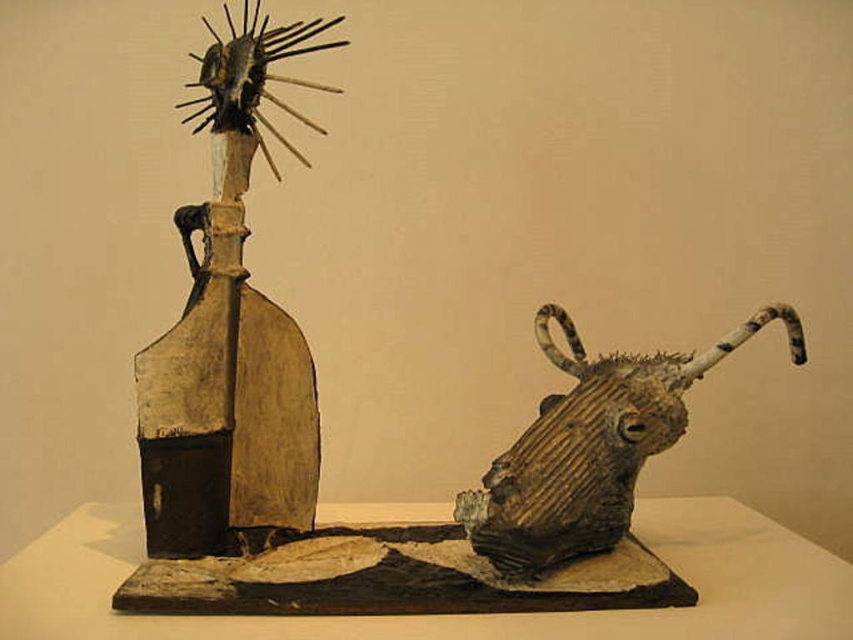
Question: Is wooden bottle at left bigger than rustic wood bull head at right?

Choices:
 (A) yes
 (B) no

Answer: (B)

Question: Which object appears farthest from the camera in this image?

Choices:
 (A) wooden bottle at left
 (B) rustic wood bull head at right

Answer: (A)

Question: Is wooden bottle at left further to the viewer compared to rustic wood bull head at right?

Choices:
 (A) yes
 (B) no

Answer: (A)

Question: Which point is farther from the camera taking this photo?

Choices:
 (A) (540, 547)
 (B) (270, 29)

Answer: (B)

Question: Which of the following is the closest to the observer?

Choices:
 (A) rustic wood bull head at right
 (B) wooden bottle at left

Answer: (A)

Question: Can you confirm if wooden bottle at left is positioned below rustic wood bull head at right?

Choices:
 (A) no
 (B) yes

Answer: (A)